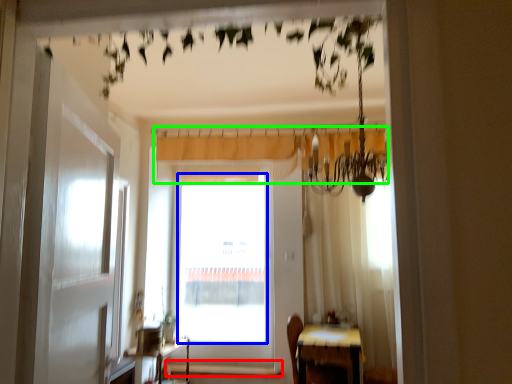
Question: Which object is positioned closest to window sill (highlighted by a red box)? Select from window screen (highlighted by a blue box) and curtain (highlighted by a green box).

Choices:
 (A) window screen
 (B) curtain

Answer: (A)